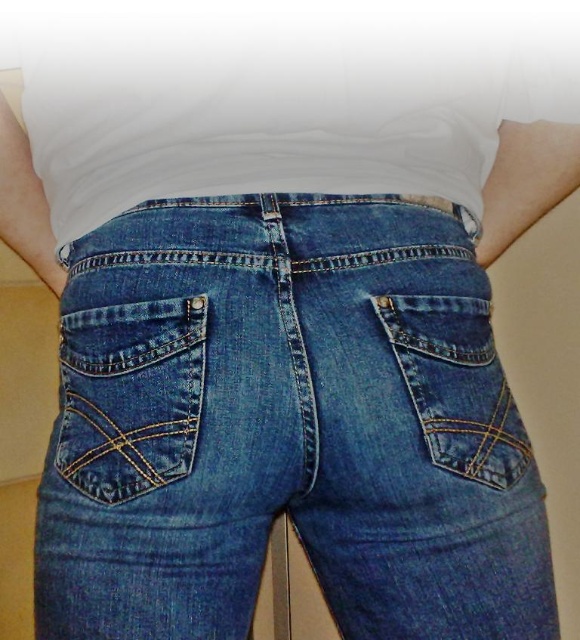
You are a fashion designer examining a model wearing the white matte shirt at center and denim pocket at lower left. Which item is closer to the camera?

The white matte shirt at center is closer to the camera because the denim pocket at lower left is behind it.